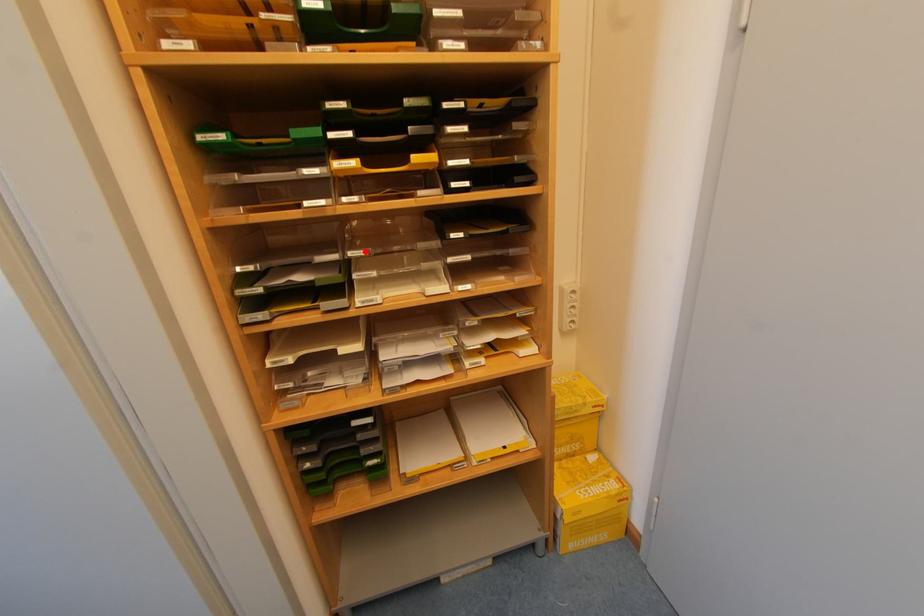
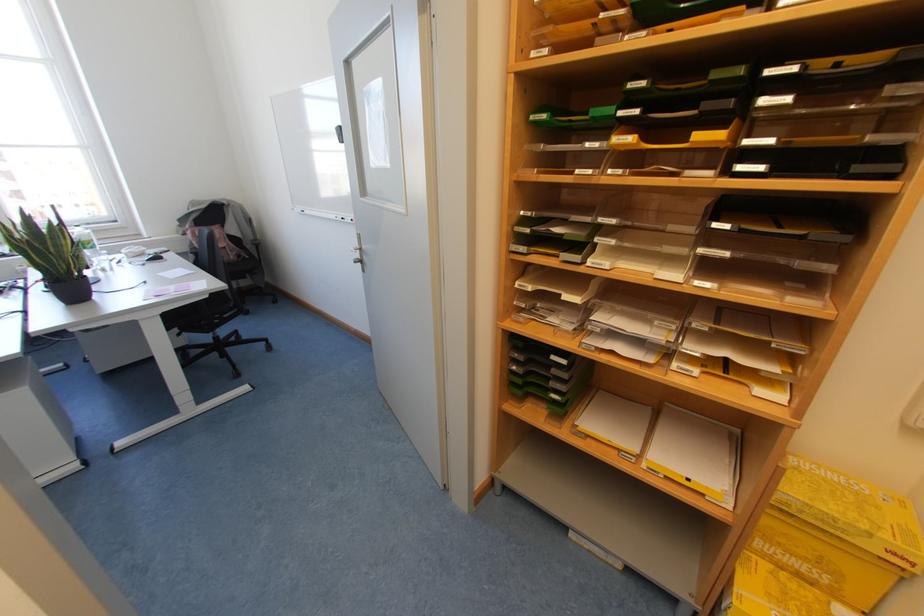
The point at the highlighted location is marked in the first image. Where is the corresponding point in the second image?

(613, 221)